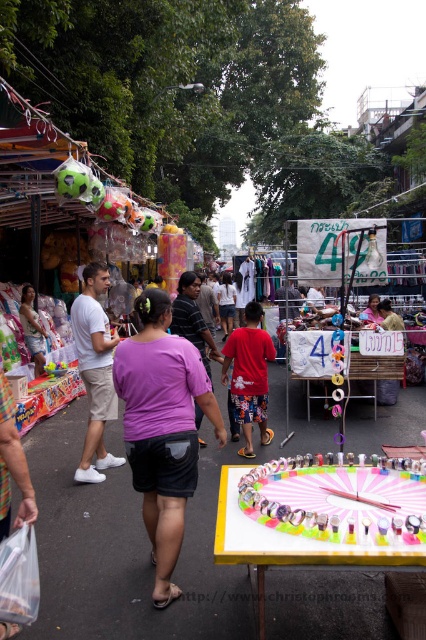
Consider the image. You are standing at the market and want to know which of the two points, point (104, 403) or point (253, 384), is closer to you. Based on the scene, can you determine which one is nearer?

Point (104, 403) is closer to the viewer than point 0.600, .594, so it is nearer.